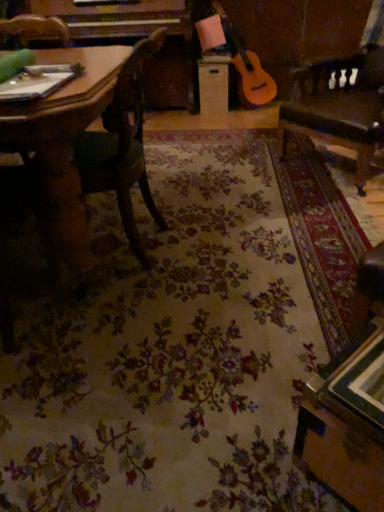
Where is `leather swivel chair at right`? The width and height of the screenshot is (384, 512). leather swivel chair at right is located at coordinates (339, 106).

What are the coordinates of `wooden chair at left` in the screenshot? It's located at [115, 143].

Where is `swivel chair on the right of wooden chair at left`? The height and width of the screenshot is (512, 384). swivel chair on the right of wooden chair at left is located at coordinates (339, 106).

Looking at this image, between wooden chair at left and leather swivel chair at right, which one has smaller width?

With smaller width is wooden chair at left.

Which object is further away from the camera taking this photo, wooden chair at left or leather swivel chair at right?

leather swivel chair at right is further from the camera.

From the picture: Between wooden chair at left and wooden drawer at center, which one is positioned behind?

wooden drawer at center is behind.

Who is smaller, wooden chair at left or wooden drawer at center?

With smaller size is wooden drawer at center.

Between wooden chair at left and wooden drawer at center, which one appears on the right side from the viewer's perspective?

From the viewer's perspective, wooden drawer at center appears more on the right side.

Looking at this image, is leather swivel chair at right looking in the opposite direction of wooden drawer at center?

That's not correct — leather swivel chair at right is not looking away from wooden drawer at center.

Considering the sizes of objects leather swivel chair at right and wooden drawer at center in the image provided, who is smaller, leather swivel chair at right or wooden drawer at center?

Smaller between the two is wooden drawer at center.

Between leather swivel chair at right and wooden drawer at center, which one appears on the left side from the viewer's perspective?

Positioned to the left is wooden drawer at center.

Can you confirm if wooden drawer at center is smaller than wooden chair at left?

Yes.

Is wooden drawer at center positioned with its back to wooden chair at left?

wooden drawer at center does not have its back to wooden chair at left.

Which is in front, wooden drawer at center or wooden chair at left?

wooden chair at left is closer to the camera.

Looking at their sizes, would you say wooden drawer at center is wider or thinner than leather swivel chair at right?

wooden drawer at center is thinner than leather swivel chair at right.

Based on the photo, between wooden drawer at center and leather swivel chair at right, which one appears on the right side from the viewer's perspective?

leather swivel chair at right is more to the right.

Image resolution: width=384 pixels, height=512 pixels. What are the coordinates of `drawer below the leather swivel chair at right (from a real-world perspective)` in the screenshot? It's located at (213, 86).

From a real-world perspective, who is located higher, wooden drawer at center or leather swivel chair at right?

In real-world perspective, leather swivel chair at right is above.

Can wooden chair at left be found inside leather swivel chair at right?

No, wooden chair at left is located outside of leather swivel chair at right.

Considering the sizes of leather swivel chair at right and wooden chair at left in the image, is leather swivel chair at right taller or shorter than wooden chair at left?

In the image, leather swivel chair at right appears to be taller than wooden chair at left.

How many degrees apart are the facing directions of leather swivel chair at right and wooden chair at left?

The angular difference between leather swivel chair at right and wooden chair at left is 41.5 degrees.

Is leather swivel chair at right in front of or behind wooden chair at left in the image?

Clearly, leather swivel chair at right is behind wooden chair at left.

What are the coordinates of `chair below the leather swivel chair at right (from the image's perspective)` in the screenshot? It's located at (115, 143).

This screenshot has width=384, height=512. Identify the location of chair on the left of wooden drawer at center. (115, 143).

Looking at the image, which one is located closer to wooden chair at left, wooden drawer at center or leather swivel chair at right?

Based on the image, leather swivel chair at right appears to be nearer to wooden chair at left.

When comparing their distances from wooden drawer at center, does leather swivel chair at right or wooden chair at left seem further?

The object further to wooden drawer at center is wooden chair at left.

Considering their positions, is wooden chair at left positioned further to leather swivel chair at right than wooden drawer at center?

wooden drawer at center is positioned further to the anchor leather swivel chair at right.

Based on the photo, when comparing their distances from leather swivel chair at right, does wooden drawer at center or wooden chair at left seem further?

wooden drawer at center is further to leather swivel chair at right.

Estimate the real-world distances between objects in this image. Which object is further from wooden drawer at center, wooden chair at left or leather swivel chair at right?

wooden chair at left.

Based on their spatial positions, is leather swivel chair at right or wooden drawer at center closer to wooden chair at left?

Among the two, leather swivel chair at right is located nearer to wooden chair at left.

Find the location of a particular element. This screenshot has width=384, height=512. swivel chair located between wooden chair at left and wooden drawer at center in the depth direction is located at coordinates (339, 106).